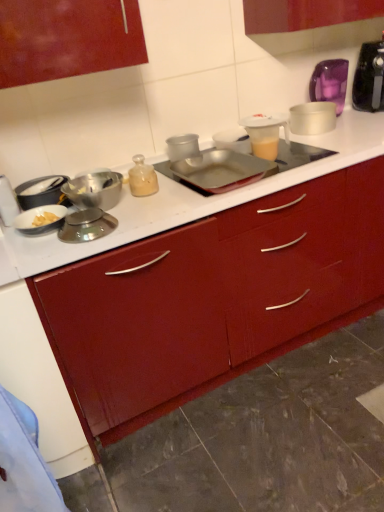
Image resolution: width=384 pixels, height=512 pixels. What are the coordinates of `free space above matte silver bowl at left, acting as the sixth kitchen appliance starting from the right (from a real-world perspective)` in the screenshot? It's located at (37, 182).